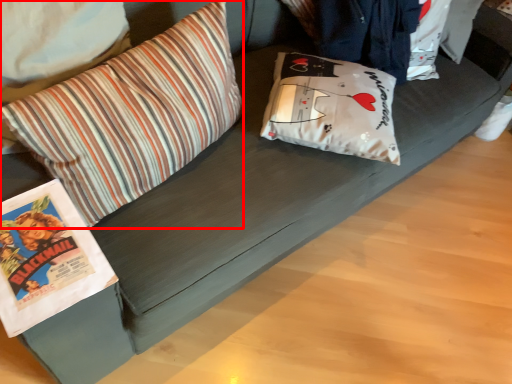
Question: From the image's perspective, what is the correct spatial positioning of pillow (annotated by the red box) in reference to pillow?

Choices:
 (A) below
 (B) above

Answer: (A)